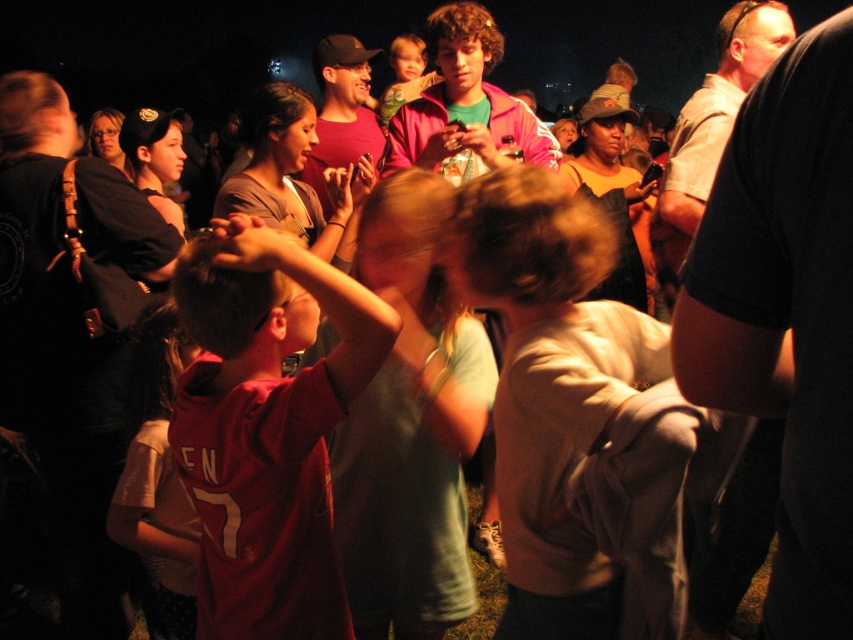
Question: Which of the following is the farthest from the observer?

Choices:
 (A) (576, 561)
 (B) (169, 394)
 (C) (317, 550)

Answer: (B)

Question: Considering the real-world distances, which object is farthest from the matte red shirt at center?

Choices:
 (A) red jersey at center
 (B) light brown cotton shirt at center

Answer: (A)

Question: Observing the image, what is the correct spatial positioning of matte red shirt at center in reference to red jersey at center?

Choices:
 (A) below
 (B) above

Answer: (B)

Question: Is matte red shirt at center to the right of red jersey at center from the viewer's perspective?

Choices:
 (A) yes
 (B) no

Answer: (A)

Question: Estimate the real-world distances between objects in this image. Which object is farther from the matte red shirt at center?

Choices:
 (A) red jersey at center
 (B) light brown cotton shirt at center

Answer: (A)

Question: Is light brown cotton shirt at center smaller than matte red shirt at center?

Choices:
 (A) yes
 (B) no

Answer: (B)